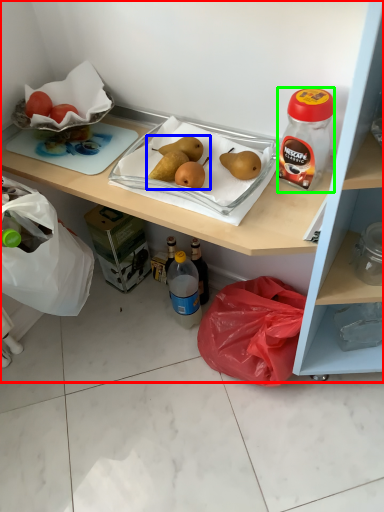
Question: Which object is the closest to the cabinetry (highlighted by a red box)? Choose among these: food (highlighted by a blue box) or bottle (highlighted by a green box).

Choices:
 (A) food
 (B) bottle

Answer: (B)